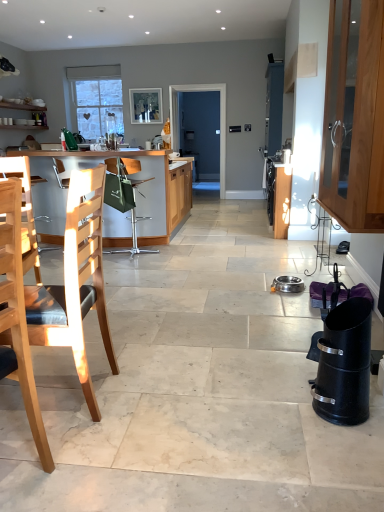
Question: From a real-world perspective, is wooden cabinet at right physically located above or below black matte trash can at lower right, the second appliance from the back?

Choices:
 (A) above
 (B) below

Answer: (A)

Question: Relative to black matte trash can at lower right, which is the first appliance from front to back, is wooden cabinet at right in front or behind?

Choices:
 (A) behind
 (B) front

Answer: (A)

Question: Considering the real-world distances, which object is farthest from the green fabric chair at center, the first chair from the back?

Choices:
 (A) metallic silver bowl at center, arranged as the 2th appliance when viewed from the front
 (B) wooden table at left
 (C) light wood chair at left, the second chair viewed from the back
 (D) blue matte screen door at center
 (E) matte wooden picture frame at upper center

Answer: (D)

Question: Which object is positioned farthest from the green fabric chair at center, which appears as the third chair when viewed from the front?

Choices:
 (A) light wood chair at left, the second chair viewed from the back
 (B) metallic silver bowl at center, arranged as the 2th appliance when viewed from the front
 (C) wooden cabinet at right
 (D) light wood chair at left, marked as the first chair in a front-to-back arrangement
 (E) wooden table at left

Answer: (D)